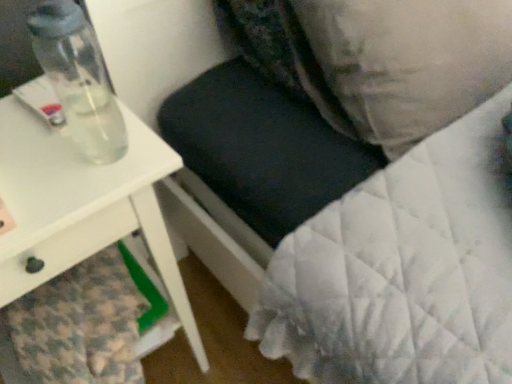
Identify the location of vacant space in front of clear glass bottle at left. (74, 197).